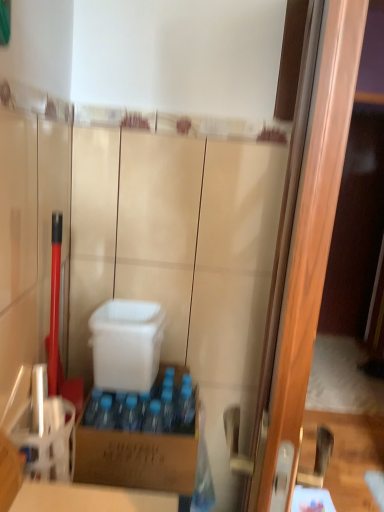
Question: Is wooden screen door at right at the back of white plastic container at center, which is counted as the 1th box, starting from the top?

Choices:
 (A) yes
 (B) no

Answer: (B)

Question: Would you say white plastic container at center, which ranks as the 2th box in bottom-to-top order, is outside wooden screen door at right?

Choices:
 (A) yes
 (B) no

Answer: (A)

Question: Is white plastic container at center, which is counted as the 1th box, starting from the top, in contact with wooden screen door at right?

Choices:
 (A) yes
 (B) no

Answer: (B)

Question: From the image's perspective, is white plastic container at center, which is counted as the 1th box, starting from the top, below wooden screen door at right?

Choices:
 (A) no
 (B) yes

Answer: (B)

Question: Is white plastic container at center, which ranks as the 2th box in bottom-to-top order, to the left of wooden screen door at right from the viewer's perspective?

Choices:
 (A) no
 (B) yes

Answer: (B)

Question: From the image's perspective, is white plastic container at center, which is counted as the 1th box, starting from the top, positioned above or below wooden screen door at right?

Choices:
 (A) below
 (B) above

Answer: (A)

Question: Is white plastic container at center, which ranks as the 2th box in bottom-to-top order, in front of or behind wooden screen door at right in the image?

Choices:
 (A) behind
 (B) front

Answer: (A)

Question: Considering the positions of white plastic container at center, which ranks as the 2th box in bottom-to-top order, and wooden screen door at right in the image, is white plastic container at center, which ranks as the 2th box in bottom-to-top order, bigger or smaller than wooden screen door at right?

Choices:
 (A) small
 (B) big

Answer: (A)

Question: Is point (144, 361) positioned closer to the camera than point (314, 158)?

Choices:
 (A) farther
 (B) closer

Answer: (A)

Question: In terms of width, does wooden screen door at right look wider or thinner when compared to brown cardboard box at center, the second box when ordered from top to bottom?

Choices:
 (A) thin
 (B) wide

Answer: (A)

Question: Considering the relative positions of wooden screen door at right and brown cardboard box at center, placed as the 1th box when sorted from bottom to top, in the image provided, is wooden screen door at right to the left or to the right of brown cardboard box at center, placed as the 1th box when sorted from bottom to top,?

Choices:
 (A) left
 (B) right

Answer: (B)

Question: From a real-world perspective, is wooden screen door at right physically located above or below brown cardboard box at center, placed as the 1th box when sorted from bottom to top?

Choices:
 (A) below
 (B) above

Answer: (B)

Question: Is wooden screen door at right taller or shorter than brown cardboard box at center, placed as the 1th box when sorted from bottom to top?

Choices:
 (A) tall
 (B) short

Answer: (A)

Question: Does point (130, 476) appear closer or farther from the camera than point (107, 329)?

Choices:
 (A) closer
 (B) farther

Answer: (A)

Question: Relative to white plastic container at center, which ranks as the 2th box in bottom-to-top order, is brown cardboard box at center, the second box when ordered from top to bottom, in front or behind?

Choices:
 (A) behind
 (B) front

Answer: (B)